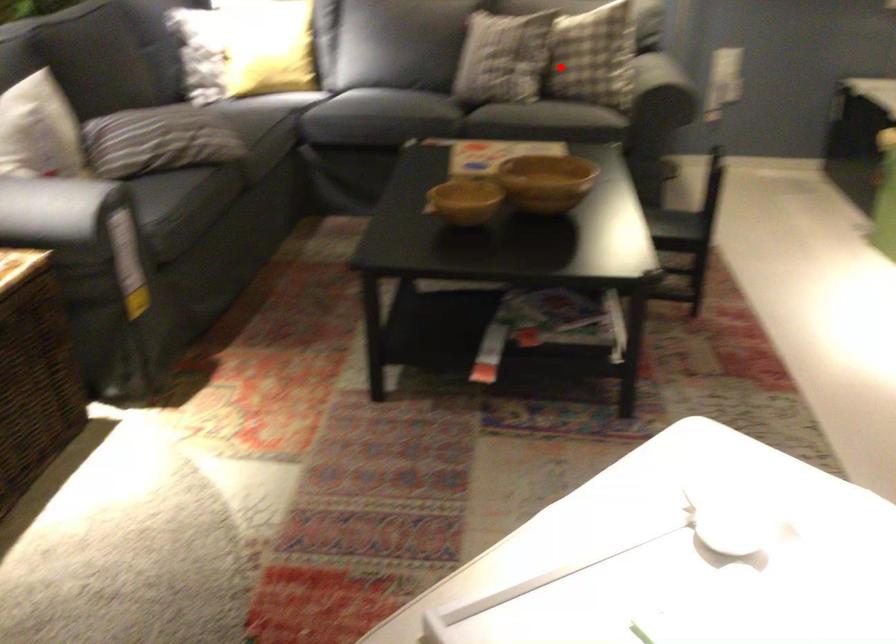
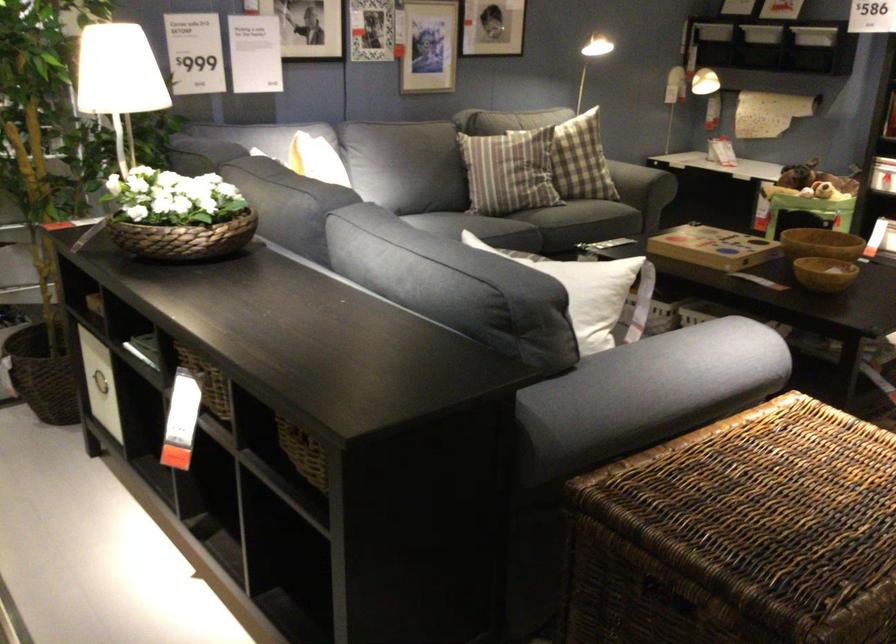
The point at the highlighted location is marked in the first image. Where is the corresponding point in the second image?

(633, 180)